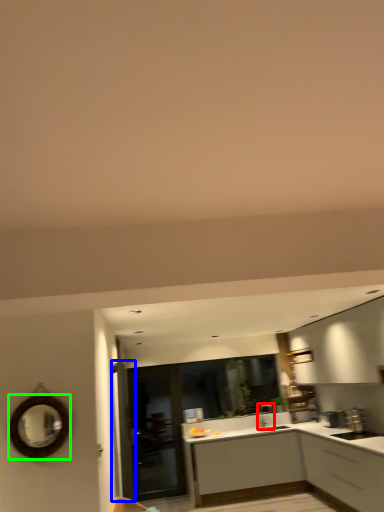
Question: Considering the real-world distances, which object is farthest from tap (highlighted by a red box)? door (highlighted by a blue box) or mirror (highlighted by a green box)?

Choices:
 (A) door
 (B) mirror

Answer: (B)